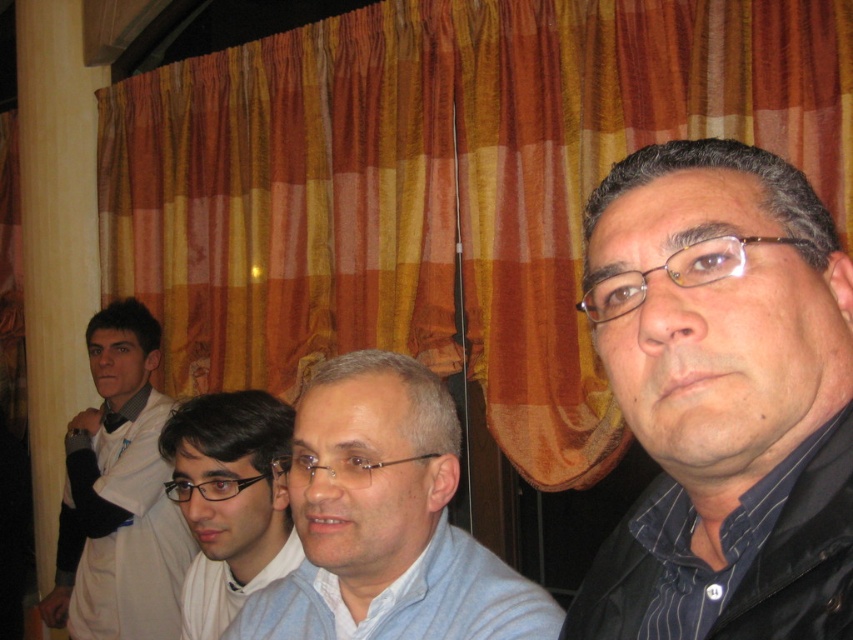
Question: Can you confirm if matte black glasses at center is positioned above transparent plastic glasses at center?

Choices:
 (A) no
 (B) yes

Answer: (A)

Question: Considering the real-world distances, which object is closest to the matte black glasses at center?

Choices:
 (A) light blue cotton dress shirt at center
 (B) light blue fabric shirt at center

Answer: (A)

Question: Which point is farther to the camera?

Choices:
 (A) light blue fabric shirt at center
 (B) matte black glasses at center
 (C) light blue cotton dress shirt at center
 (D) black plastic glasses at center

Answer: (D)

Question: Is clear plastic glasses at center positioned behind black plastic glasses at center?

Choices:
 (A) yes
 (B) no

Answer: (B)

Question: Which point is closer to the camera?

Choices:
 (A) (70, 436)
 (B) (358, 467)
 (C) (476, 616)

Answer: (B)

Question: Where is black matte shirt at center located in relation to matte black glasses at center in the image?

Choices:
 (A) right
 (B) left

Answer: (A)